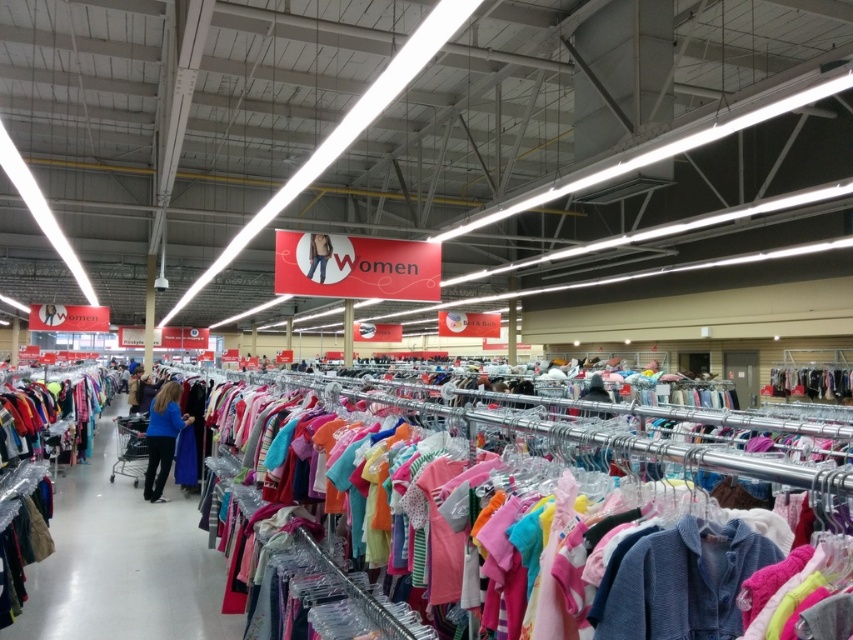
Question: Which point is closer to the camera?

Choices:
 (A) (107, 557)
 (B) (647, 564)

Answer: (B)

Question: Is matte plastic hangers at center in front of blue cotton shirt at center?

Choices:
 (A) no
 (B) yes

Answer: (B)

Question: Can you confirm if matte plastic hangers at center is positioned to the right of blue cotton shirt at center?

Choices:
 (A) no
 (B) yes

Answer: (B)

Question: Which of these objects is positioned closest to the matte blue dress at center?

Choices:
 (A) matte plastic hangers at center
 (B) blue cotton shirt at center

Answer: (B)

Question: Which of the following is the closest to the observer?

Choices:
 (A) (91, 564)
 (B) (155, 435)

Answer: (A)

Question: Is matte plastic hangers at center bigger than blue cotton shirt at center?

Choices:
 (A) no
 (B) yes

Answer: (B)